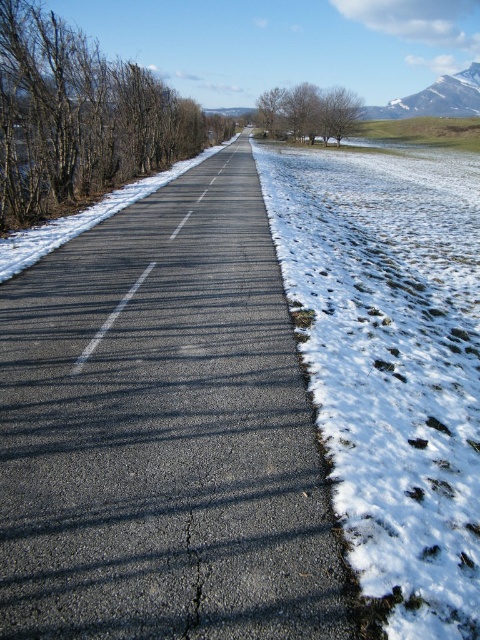
Does white powdery snow at right appear on the left side of snowy granite mountain at upper right?

Yes, white powdery snow at right is to the left of snowy granite mountain at upper right.

Which of these two, white powdery snow at right or snowy granite mountain at upper right, stands taller?

Standing taller between the two is snowy granite mountain at upper right.

This screenshot has height=640, width=480. Identify the location of white powdery snow at right. (392, 364).